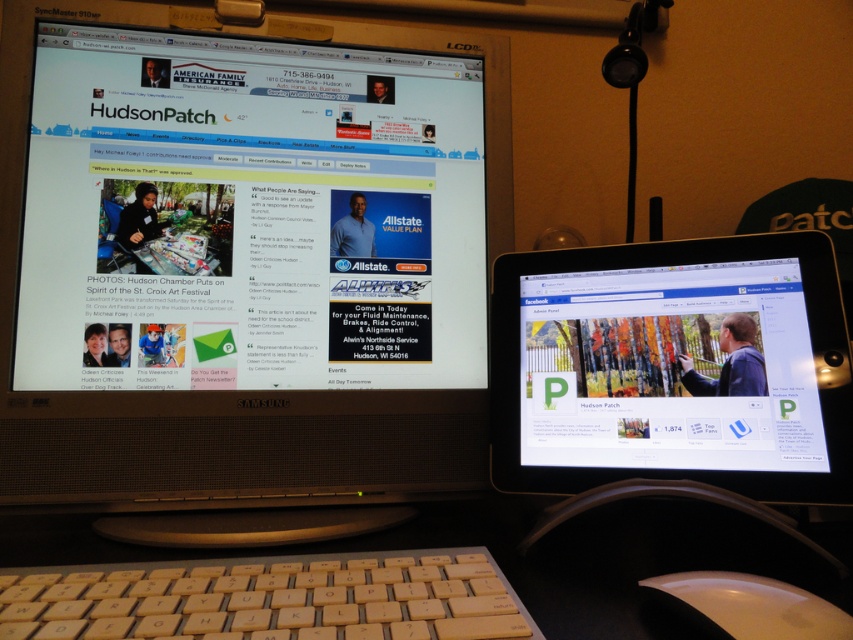
Based on the photo, you are organizing cables on your desk and need to connect a new USB cable to either the matte white tablet at right or the white glossy mouse at lower right. Based on their positions, which device is easier to reach without moving any other items?

The white glossy mouse at lower right is easier to reach because it is positioned lower and closer to the edge of the desk compared to the matte white tablet at right, which is above it.

You are setting up a new computer desk and need to place the yellow plastic keyboard at lower center and the white glossy mouse at lower right. According to the image, where should you position the keyboard relative to the mouse?

Answer: The yellow plastic keyboard at lower center should be positioned below the white glossy mouse at lower right as shown in the image.